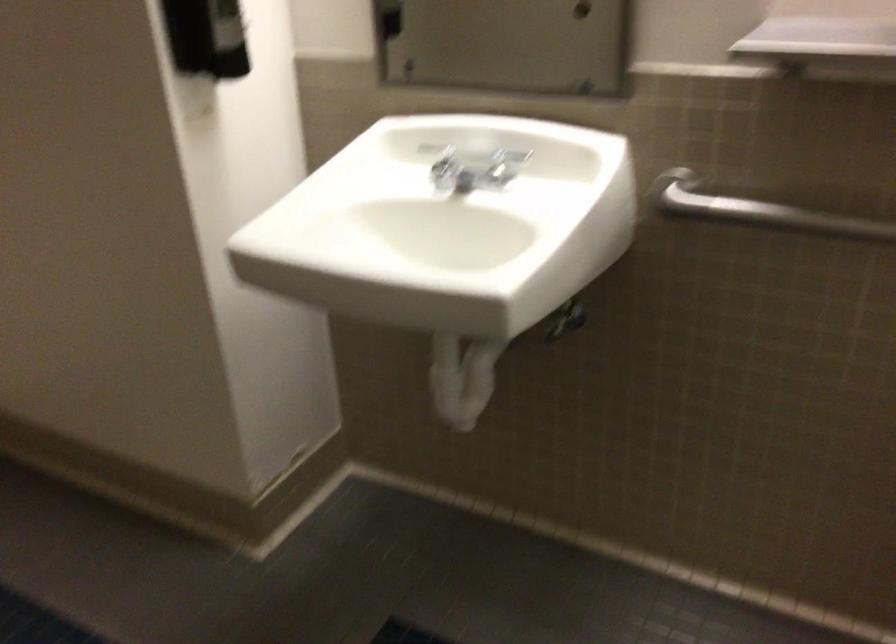
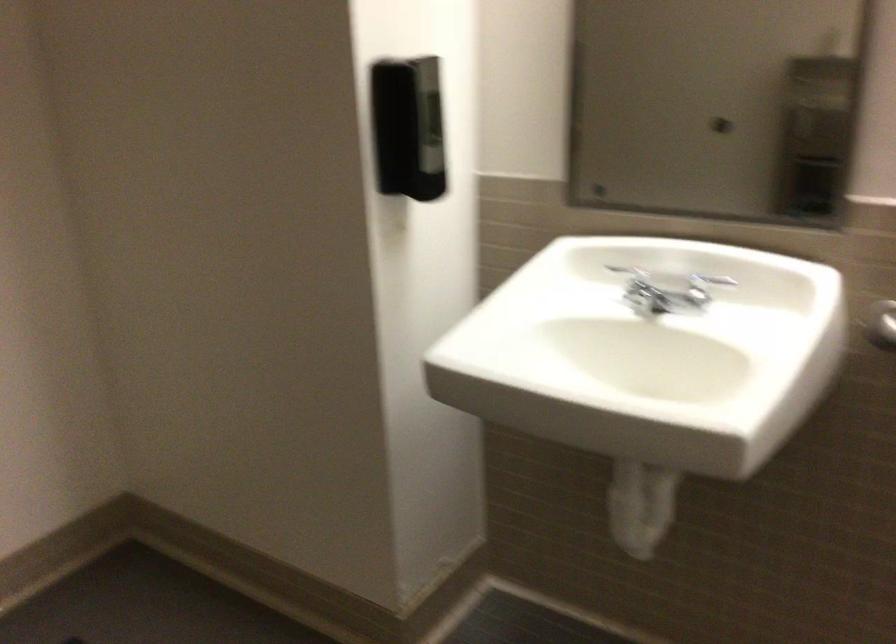
Locate, in the second image, the point that corresponds to (509,166) in the first image.

(704, 287)